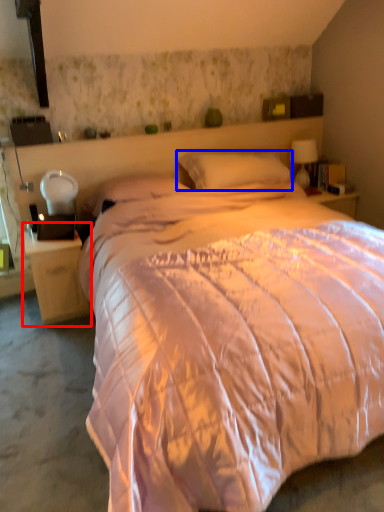
Question: Which point is further to the camera, nightstand (highlighted by a red box) or pillow (highlighted by a blue box)?

Choices:
 (A) nightstand
 (B) pillow

Answer: (B)